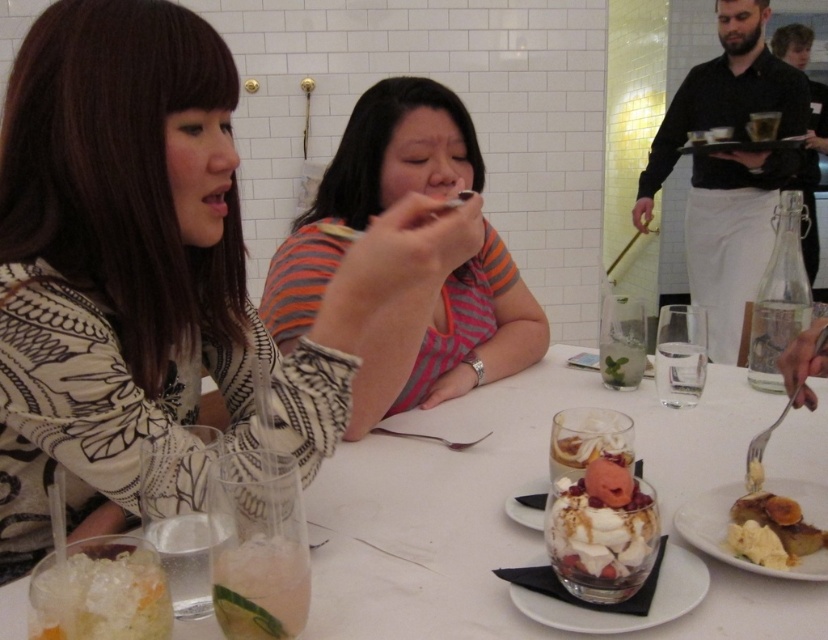
Question: Is patterned fabric shirt at upper left below white porcelain table at center?

Choices:
 (A) yes
 (B) no

Answer: (B)

Question: Can you confirm if clear gelatinous dessert at lower left is bigger than white porcelain plate at center?

Choices:
 (A) no
 (B) yes

Answer: (B)

Question: Which object appears closest to the camera in this image?

Choices:
 (A) white porcelain table at center
 (B) striped fabric shirt at center

Answer: (A)

Question: In this image, where is white porcelain table at center located relative to clear gelatinous dessert at lower left?

Choices:
 (A) above
 (B) below

Answer: (A)

Question: Among these points, which one is farthest from the camera?

Choices:
 (A) (530, 516)
 (B) (817, 502)
 (C) (230, 61)
 (D) (619, 486)

Answer: (C)

Question: Among these objects, which one is nearest to the camera?

Choices:
 (A) clear glass dessert at center
 (B) clear gelatinous dessert at lower left

Answer: (B)